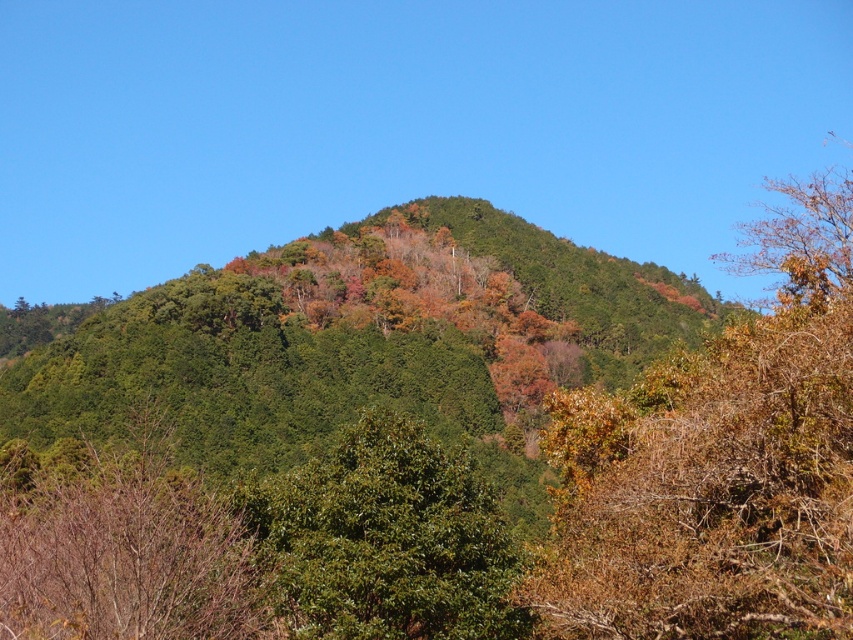
Who is positioned more to the right, brown leafy bush at right or green matte tree at center?

From the viewer's perspective, brown leafy bush at right appears more on the right side.

In the scene shown: Between brown leafy bush at right and green matte tree at center, which one is positioned lower?

Positioned lower is green matte tree at center.

Between point (642, 570) and point (178, 616), which one is positioned in front?

Point (642, 570) is more forward.

Image resolution: width=853 pixels, height=640 pixels. I want to click on brown leafy bush at right, so pos(718,461).

Is green matte tree at center to the right of green glossy bush at center from the viewer's perspective?

In fact, green matte tree at center is to the left of green glossy bush at center.

Is point (91, 496) positioned before point (360, 628)?

No, it is behind (360, 628).

Which is in front, point (215, 563) or point (375, 490)?

Positioned in front is point (375, 490).

Identify the location of green matte tree at center. (122, 545).

Does point (662, 596) come behind point (241, 483)?

No, it is not.

Between brown leafy bush at right and green glossy bush at center, which one is positioned lower?

green glossy bush at center is lower down.

Between point (683, 356) and point (463, 481), which one is positioned behind?

Positioned behind is point (683, 356).

Locate an element on the screen. brown leafy bush at right is located at coordinates (718, 461).